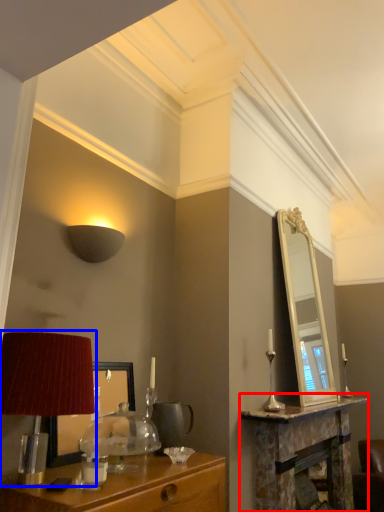
Question: Which point is further to the camera, table (highlighted by a red box) or table lamp (highlighted by a blue box)?

Choices:
 (A) table
 (B) table lamp

Answer: (A)